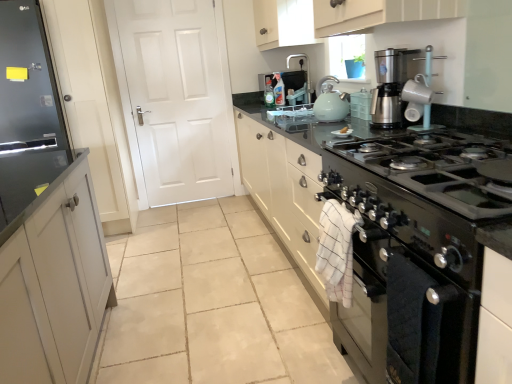
Find the location of a particular element. white matte door at center is located at coordinates (175, 97).

The image size is (512, 384). Describe the element at coordinates (407, 284) in the screenshot. I see `black stainless steel oven at lower right` at that location.

Locate an element on the screen. The image size is (512, 384). white glossy plate at center is located at coordinates (344, 130).

Describe the element at coordinates (347, 57) in the screenshot. I see `blue plastic pot at upper center` at that location.

The width and height of the screenshot is (512, 384). Find the location of `matte teal kettle at upper center`. matte teal kettle at upper center is located at coordinates (330, 102).

Find the location of a particular element. The height and width of the screenshot is (384, 512). matte white mug at upper right is located at coordinates (400, 89).

From a real-world perspective, relative to matte teal kettle at upper center, is black stainless steel oven at lower right vertically above or below?

black stainless steel oven at lower right is below matte teal kettle at upper center.

Is black stainless steel oven at lower right oriented away from matte teal kettle at upper center?

No.

Which object is positioned more to the right, black stainless steel oven at lower right or matte teal kettle at upper center?

Positioned to the right is black stainless steel oven at lower right.

Based on the photo, is the position of black stainless steel oven at lower right less distant than that of matte teal kettle at upper center?

Yes, black stainless steel oven at lower right is in front of matte teal kettle at upper center.

Considering the positions of objects matte teal kettle at upper center and black stainless steel oven at lower right in the image provided, who is in front, matte teal kettle at upper center or black stainless steel oven at lower right?

Positioned in front is black stainless steel oven at lower right.

From the image's perspective, does matte teal kettle at upper center appear higher than black stainless steel oven at lower right?

Indeed, from the image's perspective, matte teal kettle at upper center is shown above black stainless steel oven at lower right.

Considering the relative sizes of matte teal kettle at upper center and black stainless steel oven at lower right in the image provided, is matte teal kettle at upper center shorter than black stainless steel oven at lower right?

Indeed, matte teal kettle at upper center has a lesser height compared to black stainless steel oven at lower right.

How many degrees apart are the facing directions of matte teal kettle at upper center and black stainless steel oven at lower right?

matte teal kettle at upper center and black stainless steel oven at lower right are facing 0.388 degrees away from each other.

From a real-world perspective, is matte white mug at upper right physically located above or below white matte door at center?

matte white mug at upper right is situated higher than white matte door at center in the real world.

Could you tell me if matte white mug at upper right is facing white matte door at center?

No, matte white mug at upper right is not facing towards white matte door at center.

Can you see matte white mug at upper right touching white matte door at center?

No, matte white mug at upper right is not with white matte door at center.

Is matte white mug at upper right completely or partially outside of white matte door at center?

That's correct, matte white mug at upper right is outside of white matte door at center.

Based on their sizes in the image, would you say matte white mug at upper right is bigger or smaller than black stainless steel oven at lower right?

Clearly, matte white mug at upper right is smaller in size than black stainless steel oven at lower right.

Which is closer to the camera, (411, 51) or (355, 179)?

Point (411, 51).

How many degrees apart are the facing directions of matte white mug at upper right and black stainless steel oven at lower right?

There is a 3.71-degree angle between the facing directions of matte white mug at upper right and black stainless steel oven at lower right.

Are matte white mug at upper right and black stainless steel oven at lower right located far from each other?

No, matte white mug at upper right is not far away from black stainless steel oven at lower right.

From the image's perspective, is matte teal kettle at upper center beneath blue plastic pot at upper center?

Yes, from the image's perspective, matte teal kettle at upper center is beneath blue plastic pot at upper center.

In the scene shown: Could you tell me if matte teal kettle at upper center is turned towards blue plastic pot at upper center?

No, matte teal kettle at upper center is not turned towards blue plastic pot at upper center.

How distant is matte teal kettle at upper center from blue plastic pot at upper center?

matte teal kettle at upper center is 44.38 centimeters away from blue plastic pot at upper center.

Is matte teal kettle at upper center to the right of blue plastic pot at upper center from the viewer's perspective?

In fact, matte teal kettle at upper center is to the left of blue plastic pot at upper center.

Does white glossy plate at center have a greater width compared to blue plastic pot at upper center?

Incorrect, the width of white glossy plate at center does not surpass that of blue plastic pot at upper center.

The height and width of the screenshot is (384, 512). I want to click on window screen lying on the right of white glossy plate at center, so point(347,57).

Is white glossy plate at center turned away from blue plastic pot at upper center?

No.

Which is further, (346, 128) or (344, 43)?

Point (344, 43)

Are black glass stove at center and matte white mug at upper right making contact?

There is a gap between black glass stove at center and matte white mug at upper right.

Is black glass stove at center taller than matte white mug at upper right?

Indeed, black glass stove at center has a greater height compared to matte white mug at upper right.

From a real-world perspective, is black glass stove at center above or below matte white mug at upper right?

Clearly, from a real-world perspective, black glass stove at center is below matte white mug at upper right.

Which point is more distant from viewer, (395,191) or (426,104)?

Point (426,104)

Identify the location of kitchen appliance behind the black stainless steel oven at lower right. Image resolution: width=512 pixels, height=384 pixels. (330, 102).

This screenshot has width=512, height=384. Find the location of `oven located below the matte teal kettle at upper center (from the image's perspective)`. oven located below the matte teal kettle at upper center (from the image's perspective) is located at coordinates (407, 284).

When comparing their distances from white glossy plate at center, does matte silver faucet at upper center or white matte door at center seem further?

Based on the image, white matte door at center appears to be further to white glossy plate at center.

Considering their positions, is matte white mug at upper right positioned closer to blue plastic pot at upper center than matte teal kettle at upper center?

matte teal kettle at upper center lies closer to blue plastic pot at upper center than the other object.

Which object lies nearer to the anchor point black stainless steel oven at lower right, matte silver faucet at upper center or blue plastic pot at upper center?

Based on the image, blue plastic pot at upper center appears to be nearer to black stainless steel oven at lower right.

From the image, which object appears to be nearer to matte silver faucet at upper center, white glossy plate at center or blue plastic pot at upper center?

Among the two, blue plastic pot at upper center is located nearer to matte silver faucet at upper center.

When comparing their distances from white matte door at center, does white glossy plate at center or blue plastic pot at upper center seem closer?

blue plastic pot at upper center lies closer to white matte door at center than the other object.

From the image, which object appears to be farther from blue plastic pot at upper center, matte silver faucet at upper center or black stainless steel oven at lower right?

black stainless steel oven at lower right lies further to blue plastic pot at upper center than the other object.

Which object lies nearer to the anchor point matte teal kettle at upper center, black glass stove at center or black stainless steel oven at lower right?

Based on the image, black glass stove at center appears to be nearer to matte teal kettle at upper center.

Which object lies further to the anchor point white glossy plate at center, white matte door at center or matte silver faucet at upper center?

The object further to white glossy plate at center is white matte door at center.

Where is `kitchen appliance between black stainless steel oven at lower right and matte silver faucet at upper center in the front-back direction`? The image size is (512, 384). kitchen appliance between black stainless steel oven at lower right and matte silver faucet at upper center in the front-back direction is located at coordinates (330, 102).

Identify the location of food between black stainless steel oven at lower right and white matte door at center in the front-back direction. This screenshot has height=384, width=512. (344, 130).

You are a GUI agent. You are given a task and a screenshot of the screen. Output one action in this format:
    pyautogui.click(x=<x>, y=<y>)
    Task: Click on the food between matte white mug at upper right and matte silver faucet at upper center along the z-axis
    Image resolution: width=512 pixels, height=384 pixels.
    Given the screenshot: What is the action you would take?
    pyautogui.click(x=344, y=130)

At what (x,y) coordinates should I click in order to perform the action: click on kitchen appliance between matte white mug at upper right and matte silver faucet at upper center in the front-back direction. Please return your answer as a coordinate pair (x, y). Looking at the image, I should click on (330, 102).